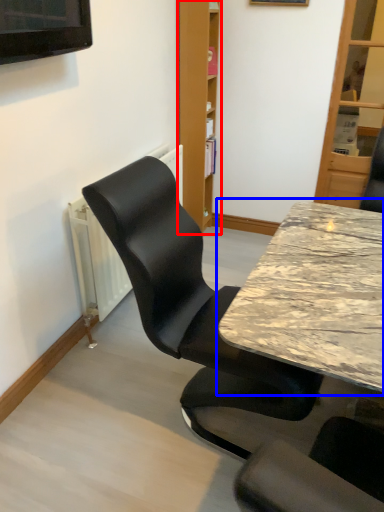
Question: Which of the following is the closest to the observer, bookshelf (highlighted by a red box) or table (highlighted by a blue box)?

Choices:
 (A) bookshelf
 (B) table

Answer: (B)